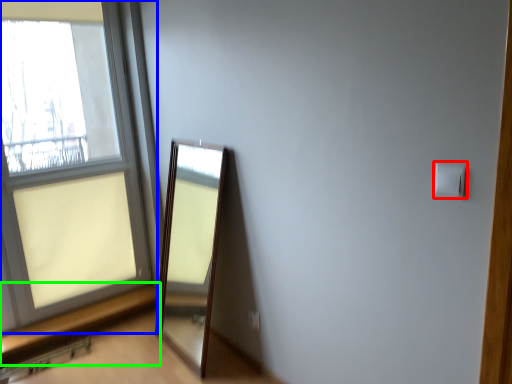
Question: Considering the real-world distances, which object is farthest from light switch (highlighted by a red box)? window (highlighted by a blue box) or window sill (highlighted by a green box)?

Choices:
 (A) window
 (B) window sill

Answer: (A)